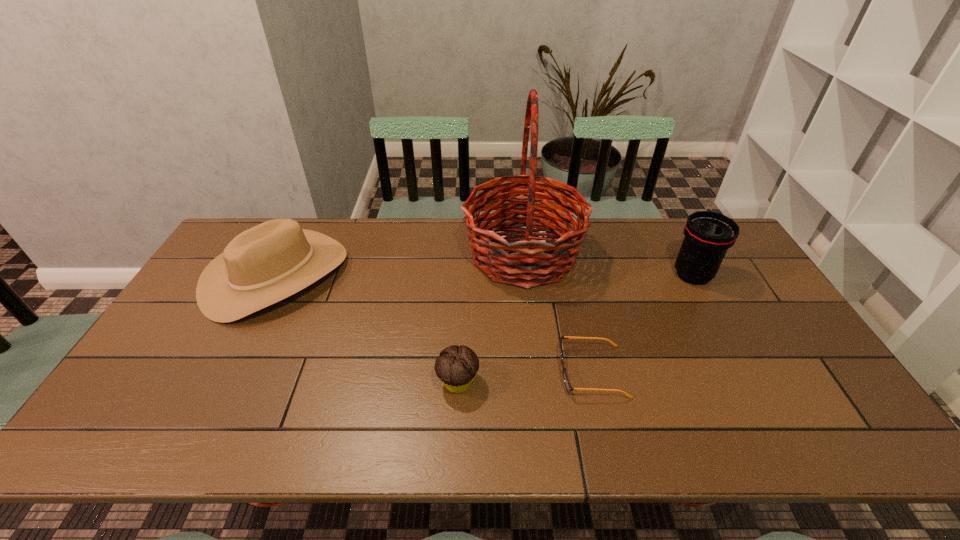
This screenshot has width=960, height=540. What are the coordinates of `free area in between the basket and the leftmost object` in the screenshot? It's located at (400, 265).

Where is `vacant space that's between the leftmost object and the rightmost object`? The image size is (960, 540). vacant space that's between the leftmost object and the rightmost object is located at coordinates (485, 275).

Identify the location of vacant area between the muffin and the third tallest object. The height and width of the screenshot is (540, 960). (368, 329).

Image resolution: width=960 pixels, height=540 pixels. I want to click on empty space that is in between the fourth tallest object and the telephoto lens, so click(575, 329).

This screenshot has height=540, width=960. I want to click on free space between the telephoto lens and the third tallest object, so click(485, 275).

Find the location of a particular element. This screenshot has height=540, width=960. object that stands as the second closest to the tallest object is located at coordinates (457, 366).

Identify the location of object that is the fourth closest to the second shortest object. This screenshot has width=960, height=540. (708, 235).

Where is `vacant space that satisfies the following two spatial constraints: 1. on the front side of the third shortest object; 2. on the left side of the second shortest object`? vacant space that satisfies the following two spatial constraints: 1. on the front side of the third shortest object; 2. on the left side of the second shortest object is located at coordinates (221, 382).

Find the location of `free space in the image that satisfies the following two spatial constraints: 1. on the handle side of the rightmost object; 2. on the right side of the basket`. free space in the image that satisfies the following two spatial constraints: 1. on the handle side of the rightmost object; 2. on the right side of the basket is located at coordinates (525, 275).